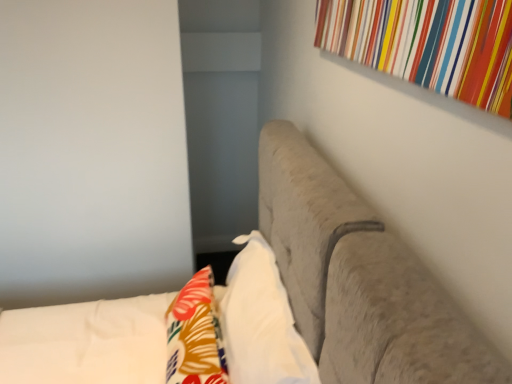
Question: Considering the positions of floral fabric throw pillow at lower left and white soft pillow at center in the image, is floral fabric throw pillow at lower left wider or thinner than white soft pillow at center?

Choices:
 (A) wide
 (B) thin

Answer: (A)

Question: In the image, is floral fabric throw pillow at lower left positioned in front of or behind white soft pillow at center?

Choices:
 (A) behind
 (B) front

Answer: (A)

Question: Which object is positioned farthest from the floral fabric throw pillow at lower left?

Choices:
 (A) white soft pillow at center
 (B) suede-like beige headboard at upper right

Answer: (B)

Question: Estimate the real-world distances between objects in this image. Which object is closer to the white soft pillow at center?

Choices:
 (A) suede-like beige headboard at upper right
 (B) floral fabric throw pillow at lower left

Answer: (B)